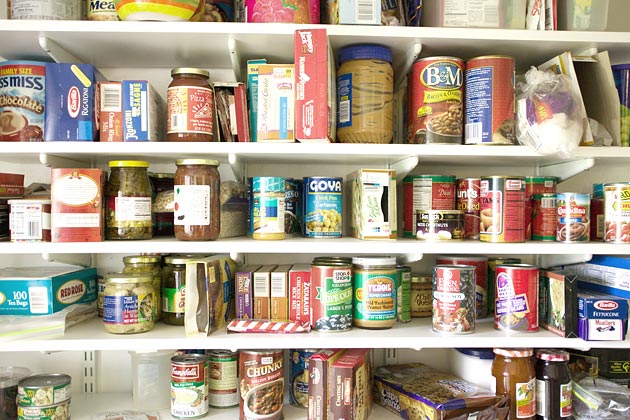
At what (x,y) coordinates should I click in order to perform the action: click on shelves. Please return your answer as a coordinate pair (x, y). This screenshot has width=630, height=420. Looking at the image, I should click on (87, 402), (112, 346), (106, 248), (108, 147), (122, 27).